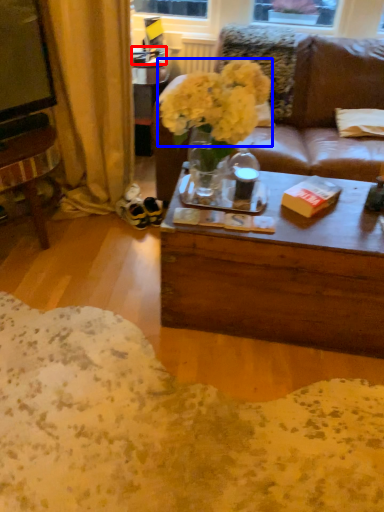
Question: Which object appears closest to the camera in this image, box (highlighted by a red box) or flower (highlighted by a blue box)?

Choices:
 (A) box
 (B) flower

Answer: (B)